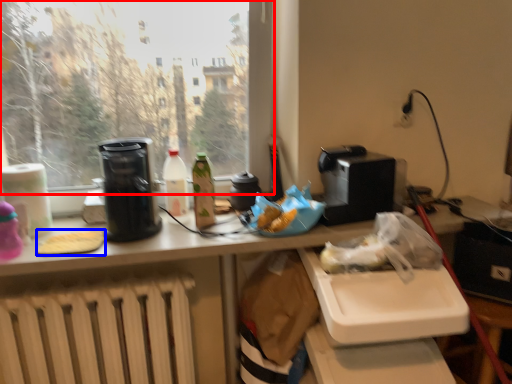
Question: Among these objects, which one is nearest to the camera, window (highlighted by a red box) or food (highlighted by a blue box)?

Choices:
 (A) window
 (B) food

Answer: (A)